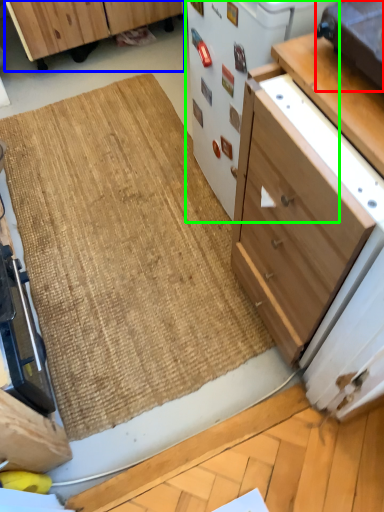
Question: Estimate the real-world distances between objects in this image. Which object is closer to appliance (highlighted by a red box), cabinetry (highlighted by a blue box) or appliance (highlighted by a green box)?

Choices:
 (A) cabinetry
 (B) appliance

Answer: (B)